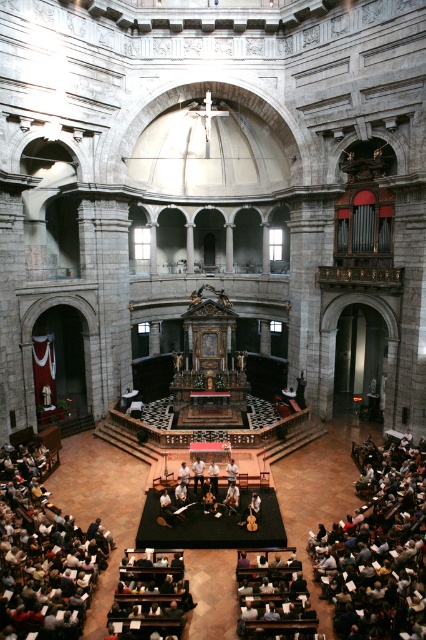
You are standing at the entrance of the grand historic church and notice the dark gray fabric at lower right. Based on its coordinates, can you determine if it is closer to the altar area or the entrance?

The dark gray fabric at lower right is located at coordinates point 0.890, which is closer to the entrance than the altar area.

Consider the image. You are an usher in the church and need to place a program on the white paper at lower left. Where exactly should you place it?

The white paper at lower left is located at point (x=43, y=554), so you should place the program there.